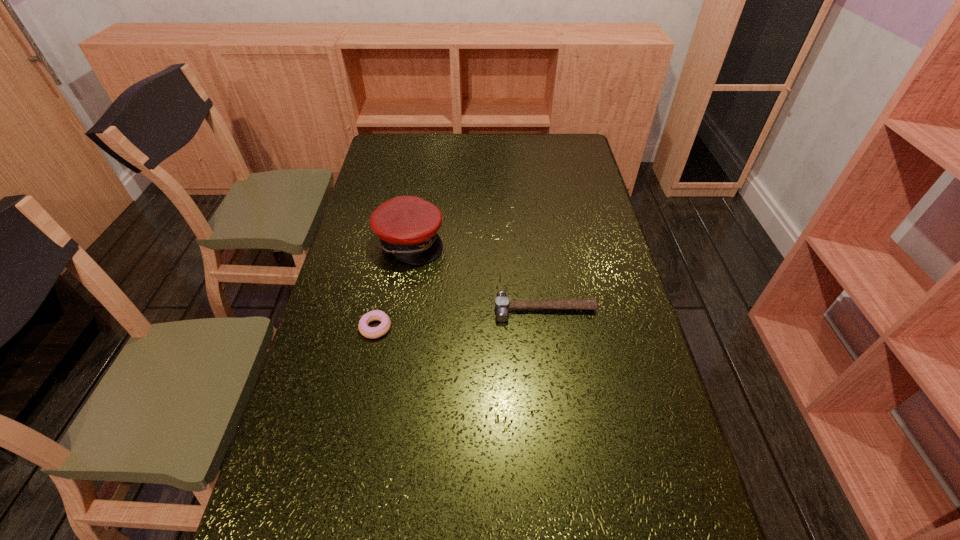
This screenshot has width=960, height=540. In order to click on the farthest object in this screenshot , I will do `click(407, 226)`.

This screenshot has width=960, height=540. In order to click on cap in this screenshot , I will do `click(407, 226)`.

What are the coordinates of `hammer` in the screenshot? It's located at (502, 304).

I want to click on doughnut, so click(368, 332).

Identify the location of vacant space located at the front of the tallest object where the visor is located. The height and width of the screenshot is (540, 960). (462, 241).

Where is `vacant space located 0.220m on the striking face of the hammer`? vacant space located 0.220m on the striking face of the hammer is located at coordinates (556, 394).

The image size is (960, 540). Identify the location of vacant space located on the back of the doughnut. (393, 242).

Where is `cap at the left edge`? cap at the left edge is located at coordinates (407, 226).

Locate an element on the screen. doughnut that is at the left edge is located at coordinates (368, 332).

The image size is (960, 540). Find the location of `object at the right edge`. object at the right edge is located at coordinates [502, 304].